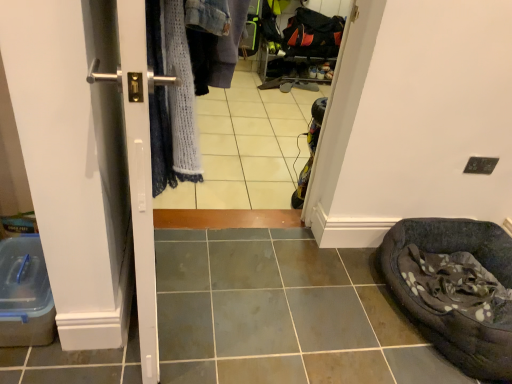
Question: Is dark gray fabric bean bag at lower right turned away from satin silver handle at left?

Choices:
 (A) no
 (B) yes

Answer: (A)

Question: Considering the relative sizes of dark gray fabric bean bag at lower right and satin silver handle at left in the image provided, is dark gray fabric bean bag at lower right smaller than satin silver handle at left?

Choices:
 (A) no
 (B) yes

Answer: (B)

Question: Does dark gray fabric bean bag at lower right appear on the left side of satin silver handle at left?

Choices:
 (A) yes
 (B) no

Answer: (B)

Question: Could you tell me if dark gray fabric bean bag at lower right is turned towards satin silver handle at left?

Choices:
 (A) yes
 (B) no

Answer: (A)

Question: Can you confirm if dark gray fabric bean bag at lower right is bigger than satin silver handle at left?

Choices:
 (A) no
 (B) yes

Answer: (A)

Question: Is dark gray fabric bean bag at lower right outside of satin silver handle at left?

Choices:
 (A) no
 (B) yes

Answer: (B)

Question: Is the position of satin silver handle at left more distant than that of white glossy tile at center?

Choices:
 (A) yes
 (B) no

Answer: (B)

Question: Is satin silver handle at left not within white glossy tile at center?

Choices:
 (A) yes
 (B) no

Answer: (A)

Question: Is satin silver handle at left bigger than white glossy tile at center?

Choices:
 (A) no
 (B) yes

Answer: (B)

Question: From the image's perspective, is satin silver handle at left beneath white glossy tile at center?

Choices:
 (A) no
 (B) yes

Answer: (B)

Question: Does satin silver handle at left have a greater width compared to white glossy tile at center?

Choices:
 (A) yes
 (B) no

Answer: (B)

Question: Is white glossy tile at center a part of satin silver handle at left?

Choices:
 (A) yes
 (B) no

Answer: (B)

Question: Is the depth of satin silver handle at left greater than that of dark gray fabric bean bag at lower right?

Choices:
 (A) no
 (B) yes

Answer: (A)